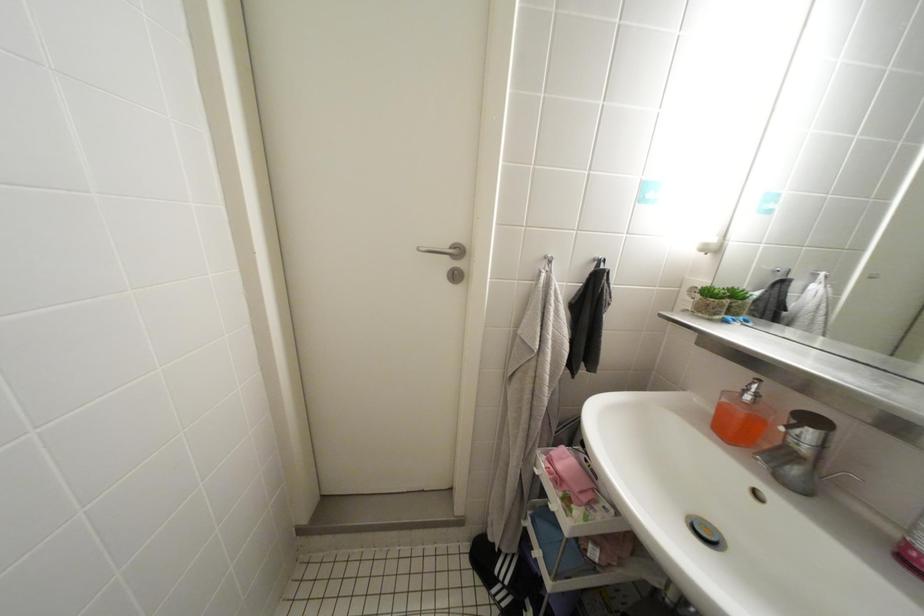
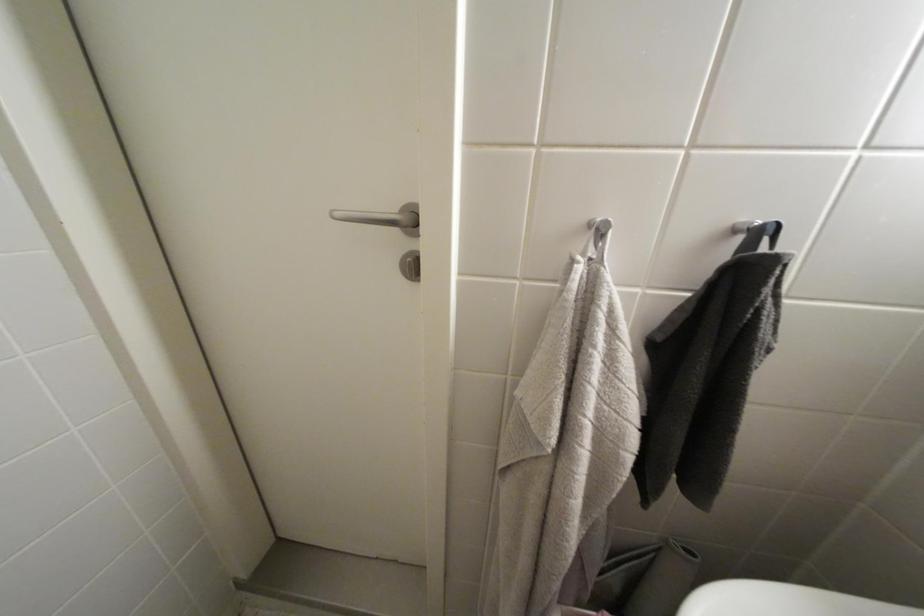
The images are taken continuously from a first-person perspective. In which direction are you moving?

The cameraman moved toward right, forward.